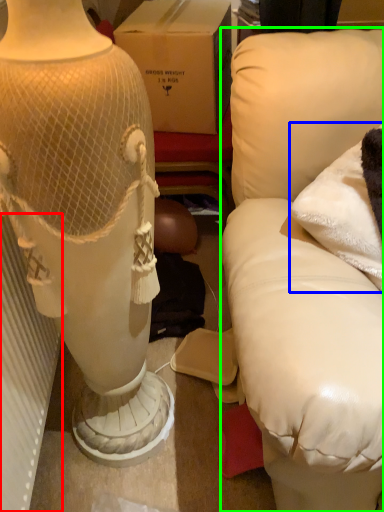
Question: Which object is positioned closest to radiator (highlighted by a red box)? Select from pillow (highlighted by a blue box) and furniture (highlighted by a green box).

Choices:
 (A) pillow
 (B) furniture

Answer: (B)